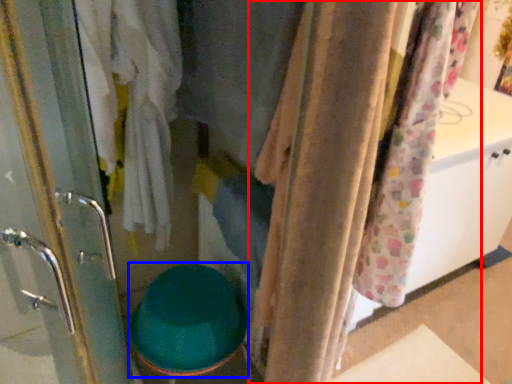
Question: Which point is closer to the camera, curtain (highlighted by a red box) or toilet bowl (highlighted by a blue box)?

Choices:
 (A) curtain
 (B) toilet bowl

Answer: (A)